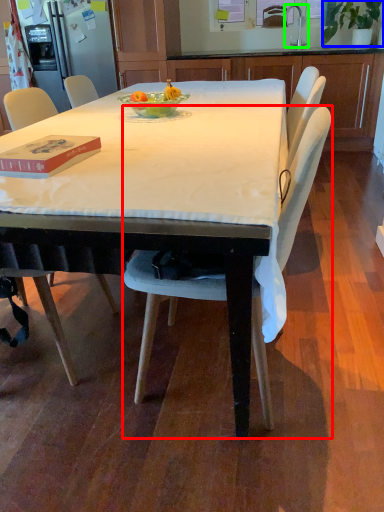
Question: Considering the real-world distances, which object is farthest from chair (highlighted by a red box)? houseplant (highlighted by a blue box) or faucet (highlighted by a green box)?

Choices:
 (A) houseplant
 (B) faucet

Answer: (B)